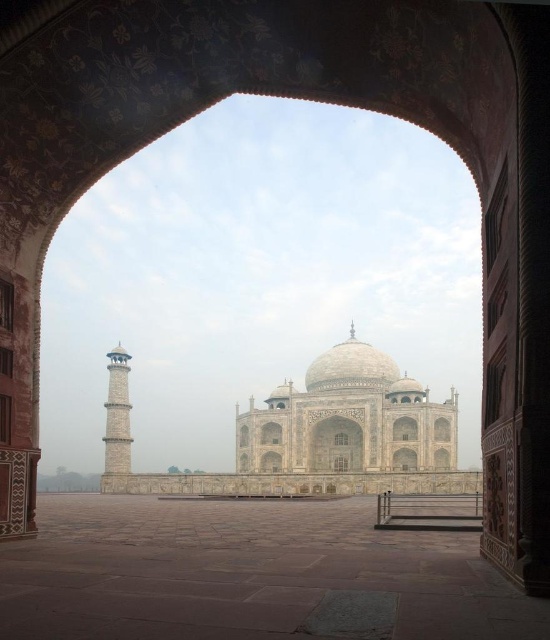
Which of these two, brown stone courtyard at center or stone minaret at left, stands shorter?

brown stone courtyard at center

Can you confirm if brown stone courtyard at center is positioned to the right of stone minaret at left?

Yes, brown stone courtyard at center is to the right of stone minaret at left.

This screenshot has width=550, height=640. I want to click on brown stone courtyard at center, so click(x=250, y=576).

The image size is (550, 640). I want to click on brown stone courtyard at center, so click(250, 576).